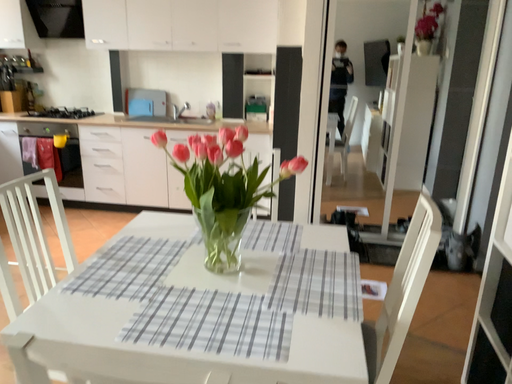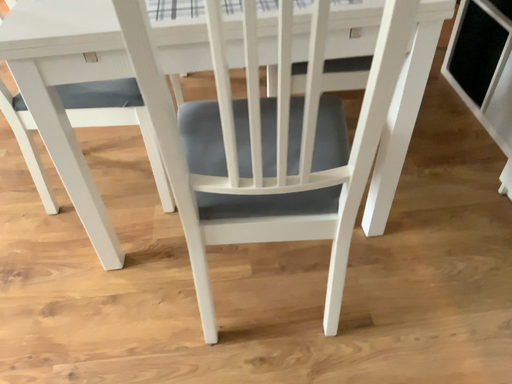
Question: How did the camera likely rotate when shooting the video?

Choices:
 (A) rotated downward
 (B) rotated upward

Answer: (A)